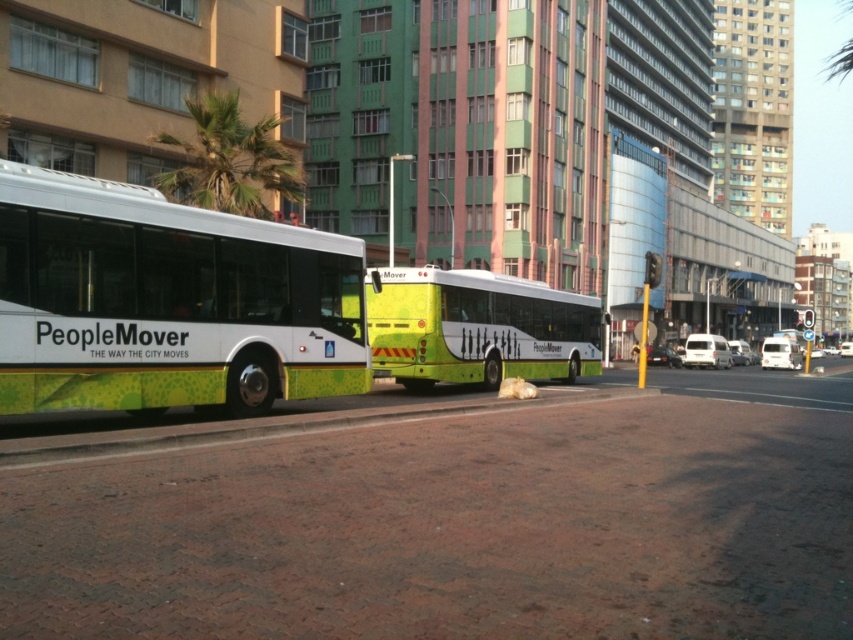
Between white glossy peoplemover bus at left and green matte bus at center, which one is positioned lower?

white glossy peoplemover bus at left is below.

Consider the image. Is white glossy peoplemover bus at left further to the viewer compared to green matte bus at center?

No, white glossy peoplemover bus at left is in front of green matte bus at center.

Image resolution: width=853 pixels, height=640 pixels. Find the location of `white glossy peoplemover bus at left`. white glossy peoplemover bus at left is located at coordinates (167, 301).

At what (x,y) coordinates should I click in order to perform the action: click on white glossy peoplemover bus at left. Please return your answer as a coordinate pair (x, y). Looking at the image, I should click on (167, 301).

Between white glossy peoplemover bus at left and yellow-green plastic bus stop at center, which one has less height?

Standing shorter between the two is white glossy peoplemover bus at left.

Is point (35, 250) closer to viewer compared to point (627, 305)?

Yes, it is.

The image size is (853, 640). Identify the location of white glossy peoplemover bus at left. (167, 301).

Does green matte bus at center come behind yellow-green plastic bus stop at center?

That is False.

At what (x,y) coordinates should I click in order to perform the action: click on green matte bus at center. Please return your answer as a coordinate pair (x, y). This screenshot has width=853, height=640. Looking at the image, I should click on (479, 328).

The height and width of the screenshot is (640, 853). I want to click on green matte bus at center, so click(x=479, y=328).